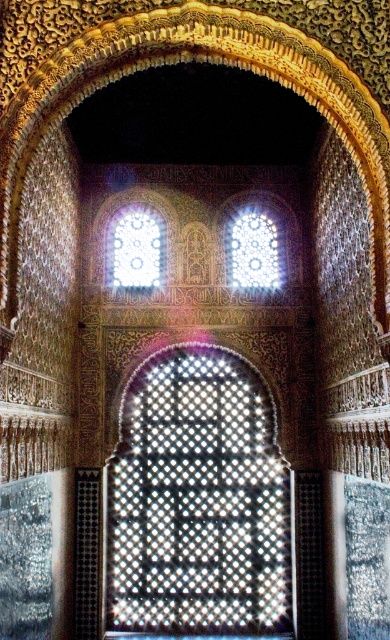
You are an architect examining the building design. You notice the transparent glass at upper center and the translucent glass window at upper center. Which glass is closer to you?

The transparent glass at upper center is closer to you as it is positioned in front of the translucent glass window at upper center.

You are an architect analyzing the symmetry of the building. There is a point at coordinate point (196, 500). What is located at this point?

The point at coordinate point (196, 500) marks the translucent mosaic at center.

Based on the scene description, where is the translucent mosaic at center located in the image?

The translucent mosaic at center is located at point (196, 500).